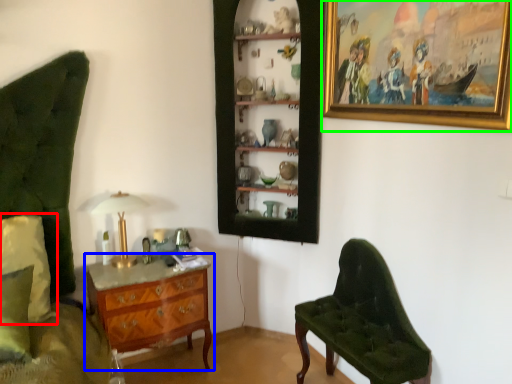
Question: Which object is the farthest from pillow (highlighted by a red box)? Choose among these: chest of drawers (highlighted by a blue box) or picture frame (highlighted by a green box).

Choices:
 (A) chest of drawers
 (B) picture frame

Answer: (B)